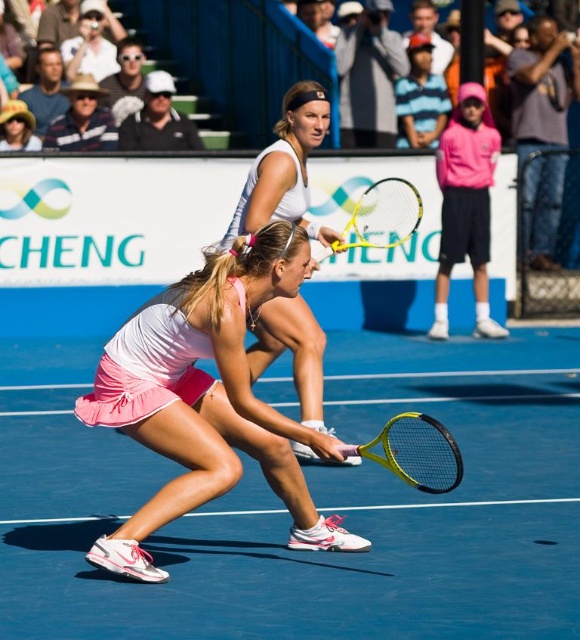
Question: Which object appears closest to the camera in this image?

Choices:
 (A) pink fabric tennis skirt at center
 (B) pink fabric tennis skirt at lower center

Answer: (B)

Question: Can you confirm if pink fabric tennis skirt at center is positioned above yellow matte tennis racket at center?

Choices:
 (A) yes
 (B) no

Answer: (A)

Question: Does pink matte tennis outfit at center appear on the right side of yellow matte tennis racket at center?

Choices:
 (A) yes
 (B) no

Answer: (A)

Question: Can you confirm if pink fabric tennis skirt at center is wider than yellow matte tennis racket at center?

Choices:
 (A) no
 (B) yes

Answer: (B)

Question: Which point is farther to the camera?

Choices:
 (A) white synthetic tennis court at center
 (B) yellow matte tennis racket at center
 (C) pink fabric tennis skirt at center
 (D) yellow frame tennis racket at center

Answer: (D)

Question: Which point is closer to the camera?

Choices:
 (A) (371, 218)
 (B) (244, 195)

Answer: (B)